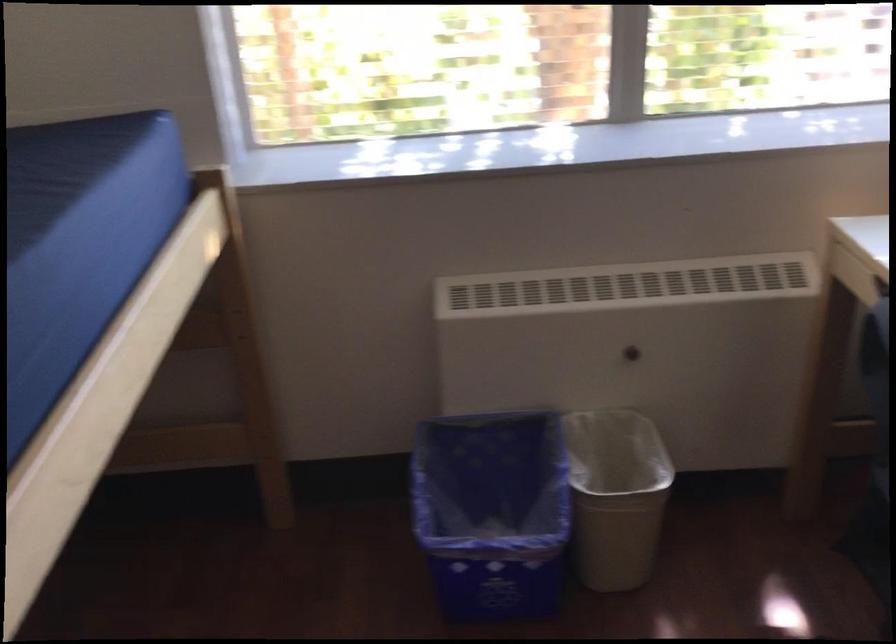
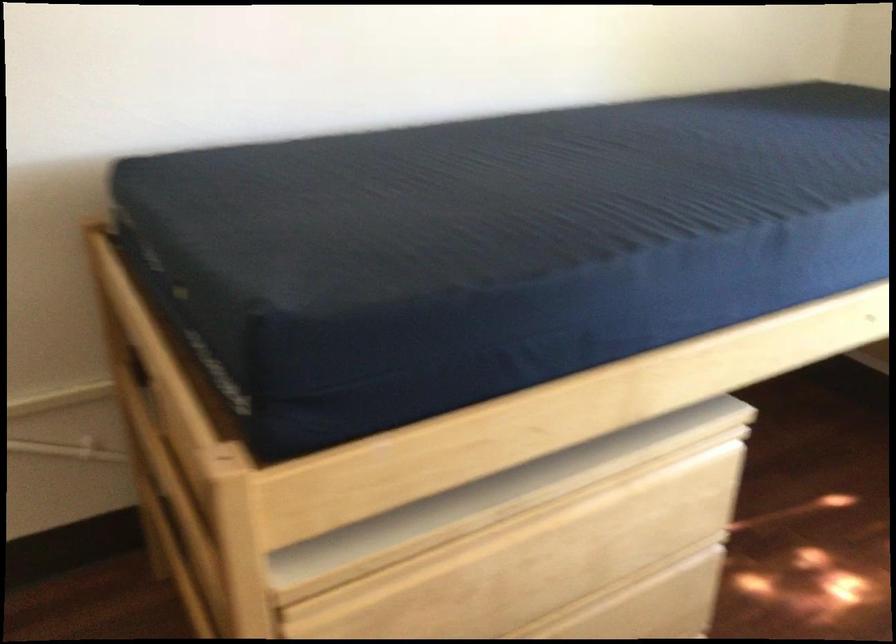
Question: The first image is from the beginning of the video and the second image is from the end. How did the camera likely rotate when shooting the video?

Choices:
 (A) Left
 (B) Right
 (C) Up
 (D) Down

Answer: (A)